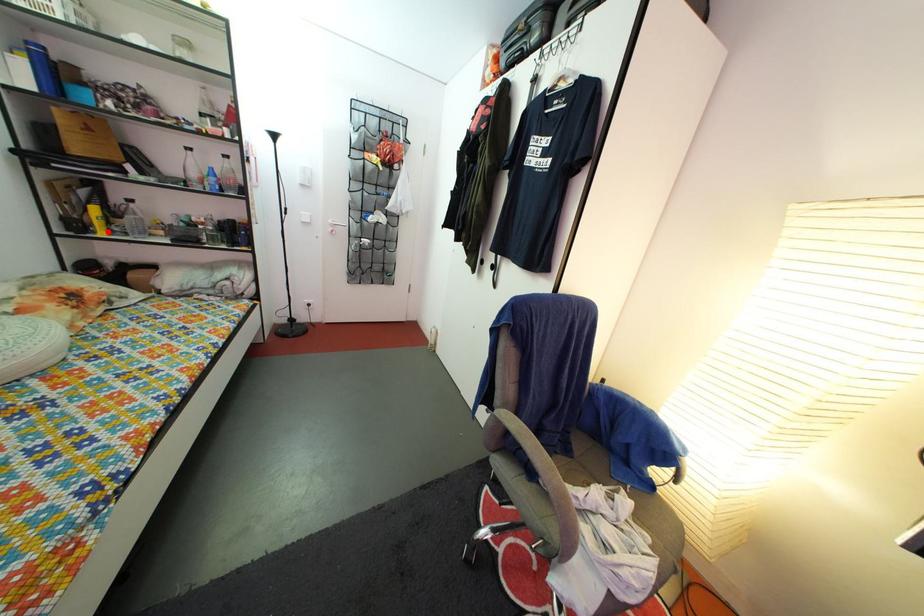
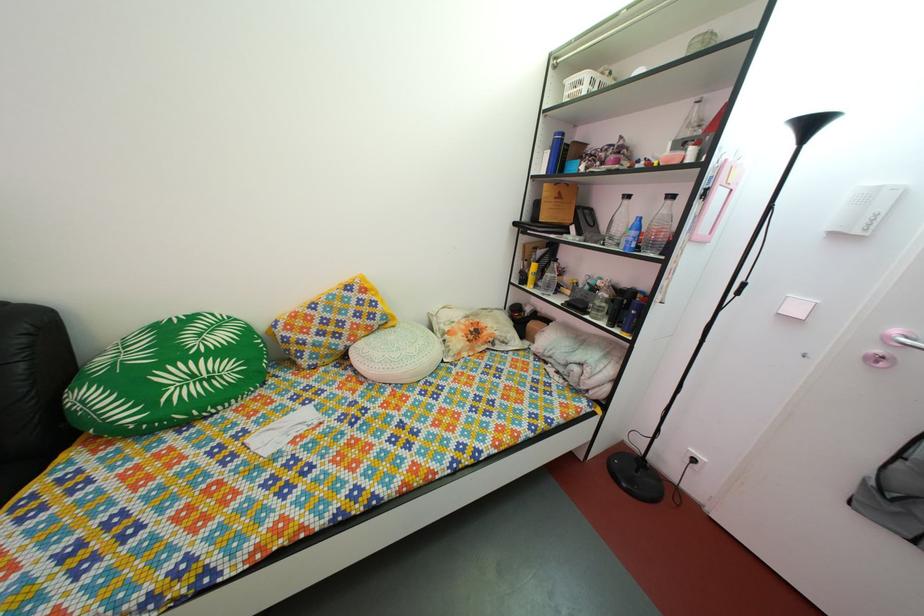
Question: I am providing you with two images of the same scene from different viewpoints. Image1 has a red point marked. In image2, the corresponding 3D location appears at what relative position? Reply with the corresponding letter.

Choices:
 (A) Closer
 (B) Farther

Answer: (A)